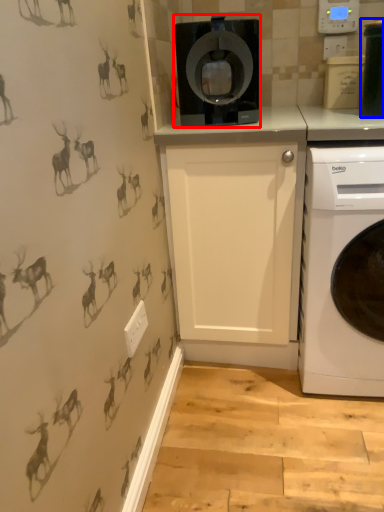
Question: Which object is further to the camera taking this photo, home appliance (highlighted by a red box) or appliance (highlighted by a blue box)?

Choices:
 (A) home appliance
 (B) appliance

Answer: (A)